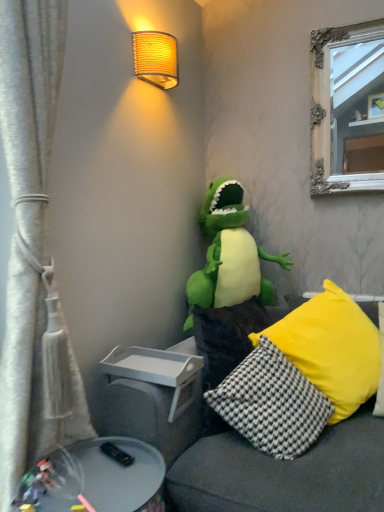
Question: Can you confirm if soft gray couch at center is wider than white textured curtain at left?

Choices:
 (A) yes
 (B) no

Answer: (A)

Question: Can you confirm if soft gray couch at center is smaller than white textured curtain at left?

Choices:
 (A) no
 (B) yes

Answer: (A)

Question: Is soft gray couch at center turned away from white textured curtain at left?

Choices:
 (A) no
 (B) yes

Answer: (A)

Question: Is there a large distance between soft gray couch at center and white textured curtain at left?

Choices:
 (A) yes
 (B) no

Answer: (B)

Question: From the image's perspective, does soft gray couch at center appear lower than white textured curtain at left?

Choices:
 (A) yes
 (B) no

Answer: (A)

Question: From the image's perspective, relative to yellow fabric pillow at right, the third pillow when ordered from left to right, is yellow textured pillow at center, positioned as the third pillow in right-to-left order, above or below?

Choices:
 (A) above
 (B) below

Answer: (B)

Question: Considering their positions, is yellow textured pillow at center, positioned as the third pillow in right-to-left order, located in front of or behind yellow fabric pillow at right, the first pillow in the right-to-left sequence?

Choices:
 (A) behind
 (B) front

Answer: (A)

Question: Is yellow textured pillow at center, positioned as the third pillow in right-to-left order, inside the boundaries of yellow fabric pillow at right, the third pillow when ordered from left to right, or outside?

Choices:
 (A) outside
 (B) inside

Answer: (A)

Question: Considering the positions of yellow textured pillow at center, positioned as the third pillow in right-to-left order, and yellow fabric pillow at right, the first pillow in the right-to-left sequence, in the image, is yellow textured pillow at center, positioned as the third pillow in right-to-left order, bigger or smaller than yellow fabric pillow at right, the first pillow in the right-to-left sequence,?

Choices:
 (A) big
 (B) small

Answer: (B)

Question: Is metallic gray tray at lower left taller or shorter than white textured curtain at left?

Choices:
 (A) short
 (B) tall

Answer: (A)

Question: Considering the positions of point (41, 477) and point (8, 309), is point (41, 477) closer or farther from the camera than point (8, 309)?

Choices:
 (A) farther
 (B) closer

Answer: (B)

Question: Is metallic gray tray at lower left inside the boundaries of white textured curtain at left, or outside?

Choices:
 (A) inside
 (B) outside

Answer: (B)

Question: From a real-world perspective, is metallic gray tray at lower left positioned above or below white textured curtain at left?

Choices:
 (A) above
 (B) below

Answer: (B)

Question: From the image's perspective, relative to soft gray couch at center, is metallic gray tray at lower left above or below?

Choices:
 (A) above
 (B) below

Answer: (B)

Question: Looking at their shapes, would you say metallic gray tray at lower left is wider or thinner than soft gray couch at center?

Choices:
 (A) thin
 (B) wide

Answer: (A)